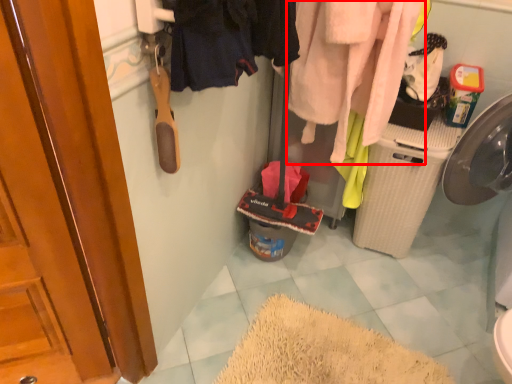
Question: From the image's perspective, where is clothing (annotated by the red box) located relative to clothing?

Choices:
 (A) below
 (B) above

Answer: (B)